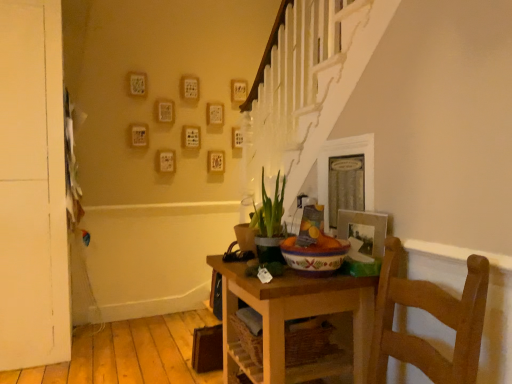
Question: Is white matte door at left positioned before wooden table at center?

Choices:
 (A) yes
 (B) no

Answer: (B)

Question: Can you confirm if white matte door at left is smaller than wooden table at center?

Choices:
 (A) no
 (B) yes

Answer: (A)

Question: Is white matte door at left not near wooden table at center?

Choices:
 (A) yes
 (B) no

Answer: (A)

Question: From the image's perspective, is white matte door at left above wooden table at center?

Choices:
 (A) no
 (B) yes

Answer: (B)

Question: Is white matte door at left looking in the opposite direction of wooden table at center?

Choices:
 (A) no
 (B) yes

Answer: (A)

Question: Is white matte door at left inside the boundaries of metallic silver photo frame at upper right, or outside?

Choices:
 (A) inside
 (B) outside

Answer: (B)

Question: Based on their sizes in the image, would you say white matte door at left is bigger or smaller than metallic silver photo frame at upper right?

Choices:
 (A) big
 (B) small

Answer: (A)

Question: Is point (15, 357) positioned closer to the camera than point (337, 236)?

Choices:
 (A) closer
 (B) farther

Answer: (B)

Question: In the image, is white matte door at left positioned in front of or behind metallic silver photo frame at upper right?

Choices:
 (A) front
 (B) behind

Answer: (B)

Question: Is metallic silver photo frame at upper right wider or thinner than wooden table at center?

Choices:
 (A) wide
 (B) thin

Answer: (B)

Question: Considering the positions of metallic silver photo frame at upper right and wooden table at center in the image, is metallic silver photo frame at upper right taller or shorter than wooden table at center?

Choices:
 (A) tall
 (B) short

Answer: (B)

Question: Does point (345, 233) appear closer or farther from the camera than point (212, 263)?

Choices:
 (A) farther
 (B) closer

Answer: (B)

Question: Would you say metallic silver photo frame at upper right is inside or outside wooden table at center?

Choices:
 (A) inside
 (B) outside

Answer: (B)

Question: In terms of height, does green matte plant at center look taller or shorter compared to metallic silver photo frame at upper right?

Choices:
 (A) short
 (B) tall

Answer: (B)

Question: From a real-world perspective, is green matte plant at center physically located above or below metallic silver photo frame at upper right?

Choices:
 (A) below
 (B) above

Answer: (B)